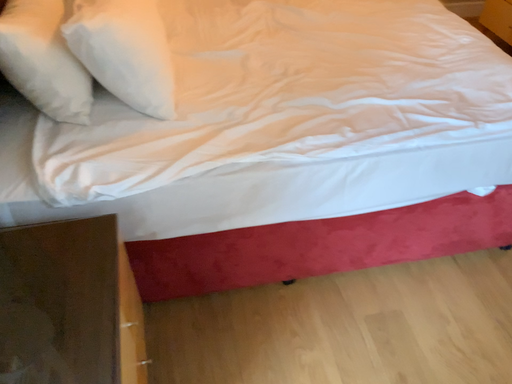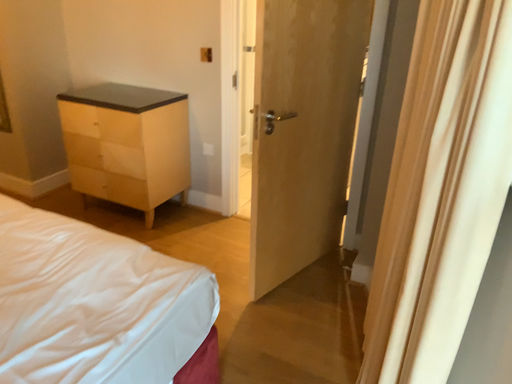
Question: How did the camera likely rotate when shooting the video?

Choices:
 (A) rotated left
 (B) rotated right

Answer: (B)